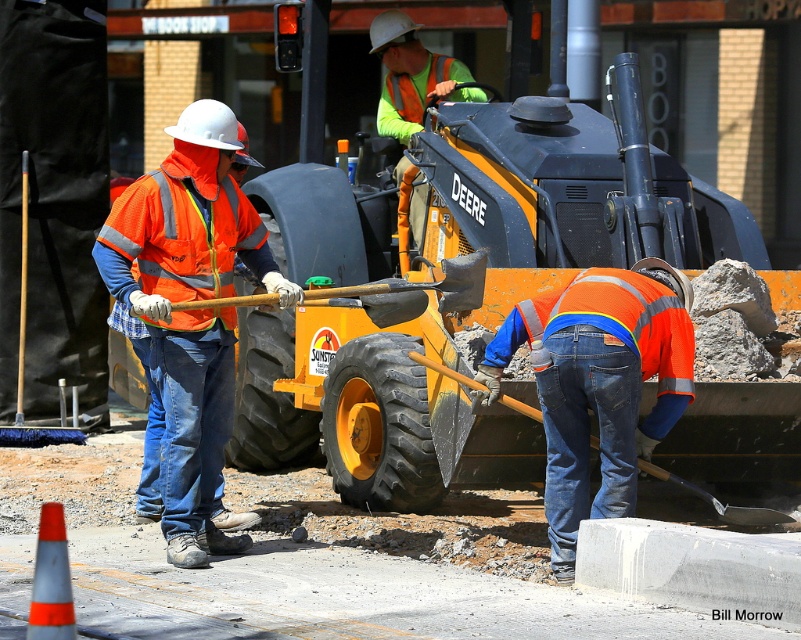
Between wooden handle shovel at center and matte black shovel at lower center, which one appears on the left side from the viewer's perspective?

wooden handle shovel at center is more to the left.

Between wooden handle shovel at center and matte black shovel at lower center, which one is positioned lower?

matte black shovel at lower center

Identify the location of wooden handle shovel at center. (429, 284).

Find the location of `wooden handle shovel at center`. wooden handle shovel at center is located at coordinates (429, 284).

Is yellow rubber tire at center above orange reflective vest at left?

Yes.

Who is more forward, (739, 252) or (127, 218)?

Point (127, 218)

The width and height of the screenshot is (801, 640). In order to click on yellow rubber tire at center in this screenshot , I will do `click(457, 259)`.

I want to click on yellow rubber tire at center, so click(x=457, y=259).

Is point (252, 371) farther from camera compared to point (473, 298)?

Yes, point (252, 371) is farther from viewer.

Does point (473, 460) lie in front of point (484, 268)?

No, it is behind (484, 268).

Is point (256, 196) positioned after point (482, 250)?

That is True.

Identify the location of yellow rubber tire at center. (457, 259).